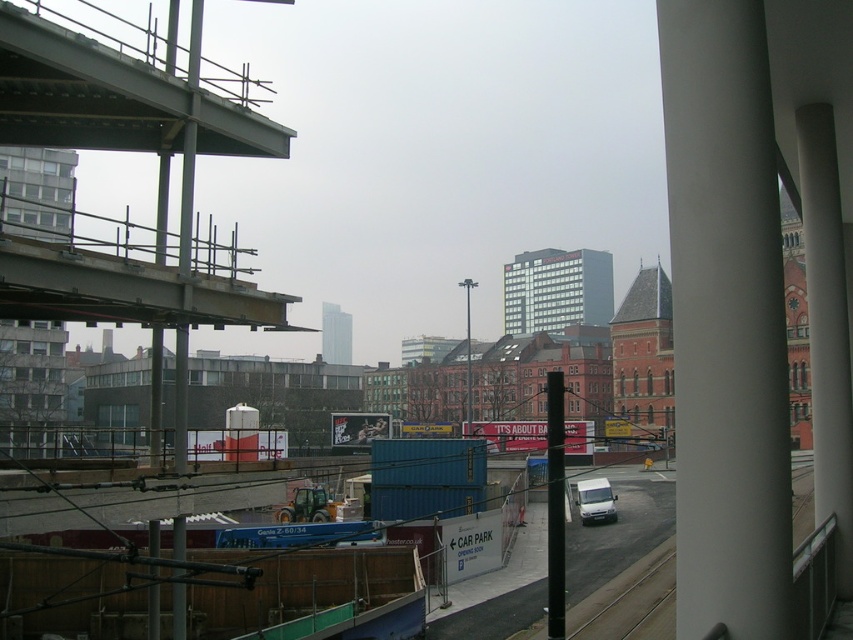
Can you confirm if gray metallic overpass at upper left is thinner than gray concrete train track at lower center?

No, gray metallic overpass at upper left is not thinner than gray concrete train track at lower center.

Between gray metallic overpass at upper left and gray concrete train track at lower center, which one appears on the right side from the viewer's perspective?

Positioned to the right is gray concrete train track at lower center.

Is point (108, 74) more distant than point (670, 563)?

No, it is in front of (670, 563).

At what (x,y) coordinates should I click in order to perform the action: click on gray metallic overpass at upper left. Please return your answer as a coordinate pair (x, y). Looking at the image, I should click on 111,99.

Does gray metallic overpass at upper left have a smaller size compared to white matte van at center?

Actually, gray metallic overpass at upper left might be larger than white matte van at center.

Between gray metallic overpass at upper left and white matte van at center, which one has less height?

white matte van at center

Describe the element at coordinates (111, 99) in the screenshot. I see `gray metallic overpass at upper left` at that location.

Locate an element on the screen. gray metallic overpass at upper left is located at coordinates (111, 99).

Describe the element at coordinates (627, 596) in the screenshot. I see `gray concrete train track at lower center` at that location.

Does gray concrete train track at lower center have a greater width compared to white matte van at center?

Indeed, gray concrete train track at lower center has a greater width compared to white matte van at center.

Locate an element on the screen. The width and height of the screenshot is (853, 640). gray concrete train track at lower center is located at coordinates (627, 596).